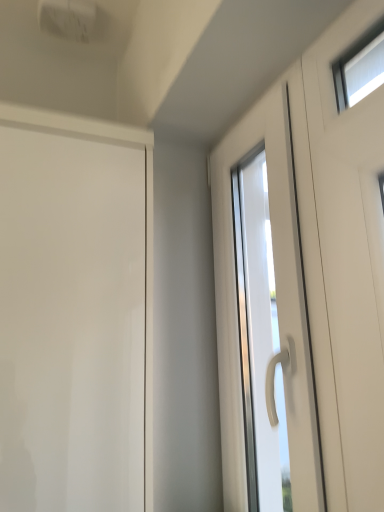
The image size is (384, 512). Describe the element at coordinates (277, 305) in the screenshot. I see `white glossy door at center, the 1th door viewed from the right` at that location.

Where is `white glossy door at center, the 1th door viewed from the right`? Image resolution: width=384 pixels, height=512 pixels. white glossy door at center, the 1th door viewed from the right is located at coordinates (x=277, y=305).

Describe the element at coordinates (71, 323) in the screenshot. I see `glossy white door at left, the 2th door from the right` at that location.

Find the location of a particular element. This screenshot has height=512, width=384. glossy white door at left, the 2th door from the right is located at coordinates (x=71, y=323).

The image size is (384, 512). Find the location of `white glossy door at center, which is the 2th door from left to right`. white glossy door at center, which is the 2th door from left to right is located at coordinates (277, 305).

Consider the image. Can you confirm if glossy white door at left, the 2th door from the right, is positioned to the left of white glossy door at center, which is the 2th door from left to right?

Correct, you'll find glossy white door at left, the 2th door from the right, to the left of white glossy door at center, which is the 2th door from left to right.

Which is in front, glossy white door at left, which ranks as the first door in left-to-right order, or white glossy door at center, the 1th door viewed from the right?

glossy white door at left, which ranks as the first door in left-to-right order, is more forward.

Is point (92, 303) closer or farther from the camera than point (218, 192)?

Point (92, 303).

From the image's perspective, is glossy white door at left, which ranks as the first door in left-to-right order, positioned above or below white glossy door at center, the 1th door viewed from the right?

glossy white door at left, which ranks as the first door in left-to-right order, is situated lower than white glossy door at center, the 1th door viewed from the right, in the image.

From a real-world perspective, is glossy white door at left, the 2th door from the right, physically above white glossy door at center, the 1th door viewed from the right?

Incorrect, from a real-world perspective, glossy white door at left, the 2th door from the right, is lower than white glossy door at center, the 1th door viewed from the right.

Considering the relative sizes of glossy white door at left, which ranks as the first door in left-to-right order, and white glossy door at center, which is the 2th door from left to right, in the image provided, is glossy white door at left, which ranks as the first door in left-to-right order, thinner than white glossy door at center, which is the 2th door from left to right,?

No, glossy white door at left, which ranks as the first door in left-to-right order, is not thinner than white glossy door at center, which is the 2th door from left to right.

Does glossy white door at left, the 2th door from the right, have a lesser height compared to white glossy door at center, the 1th door viewed from the right?

Yes, glossy white door at left, the 2th door from the right, is shorter than white glossy door at center, the 1th door viewed from the right.

Who is bigger, glossy white door at left, the 2th door from the right, or white glossy door at center, the 1th door viewed from the right?

glossy white door at left, the 2th door from the right, is bigger.

Is white glossy door at center, which is the 2th door from left to right, inside glossy white door at left, the 2th door from the right?

No, white glossy door at center, which is the 2th door from left to right, is not inside glossy white door at left, the 2th door from the right.

Is glossy white door at left, which ranks as the first door in left-to-right order, not near white glossy door at center, the 1th door viewed from the right?

Actually, glossy white door at left, which ranks as the first door in left-to-right order, and white glossy door at center, the 1th door viewed from the right, are a little close together.

Does glossy white door at left, the 2th door from the right, turn towards white glossy door at center, which is the 2th door from left to right?

No, glossy white door at left, the 2th door from the right, is not turned towards white glossy door at center, which is the 2th door from left to right.

Locate an element on the screen. Image resolution: width=384 pixels, height=512 pixels. door above the glossy white door at left, the 2th door from the right (from the image's perspective) is located at coordinates (277, 305).

Which object is positioned more to the right, white glossy door at center, the 1th door viewed from the right, or glossy white door at left, which ranks as the first door in left-to-right order?

Positioned to the right is white glossy door at center, the 1th door viewed from the right.

Which is in front, white glossy door at center, the 1th door viewed from the right, or glossy white door at left, the 2th door from the right?

glossy white door at left, the 2th door from the right, is in front.

Which is nearer, (320, 490) or (103, 385)?

Point (320, 490) appears to be closer to the viewer than point (103, 385).

From the image's perspective, would you say white glossy door at center, which is the 2th door from left to right, is shown under glossy white door at left, the 2th door from the right?

No, from the image's perspective, white glossy door at center, which is the 2th door from left to right, is not below glossy white door at left, the 2th door from the right.

From a real-world perspective, is white glossy door at center, the 1th door viewed from the right, physically located above or below glossy white door at left, which ranks as the first door in left-to-right order?

white glossy door at center, the 1th door viewed from the right, is above glossy white door at left, which ranks as the first door in left-to-right order.

Can you confirm if white glossy door at center, which is the 2th door from left to right, is wider than glossy white door at left, the 2th door from the right?

No.

Which of these two, white glossy door at center, the 1th door viewed from the right, or glossy white door at left, the 2th door from the right, stands shorter?

glossy white door at left, the 2th door from the right.

Who is bigger, white glossy door at center, the 1th door viewed from the right, or glossy white door at left, the 2th door from the right?

glossy white door at left, the 2th door from the right, is bigger.

Looking at this image, would you say white glossy door at center, which is the 2th door from left to right, is inside or outside glossy white door at left, which ranks as the first door in left-to-right order?

white glossy door at center, which is the 2th door from left to right, is outside glossy white door at left, which ranks as the first door in left-to-right order.

Is white glossy door at center, the 1th door viewed from the right, positioned far away from glossy white door at left, the 2th door from the right?

No, white glossy door at center, the 1th door viewed from the right, is not far from glossy white door at left, the 2th door from the right.

Consider the image. Is white glossy door at center, which is the 2th door from left to right, looking in the opposite direction of glossy white door at left, which ranks as the first door in left-to-right order?

No.

How different are the orientations of white glossy door at center, the 1th door viewed from the right, and glossy white door at left, which ranks as the first door in left-to-right order, in degrees?

The facing directions of white glossy door at center, the 1th door viewed from the right, and glossy white door at left, which ranks as the first door in left-to-right order, are 91.4 degrees apart.

This screenshot has width=384, height=512. What are the coordinates of `door in front of the white glossy door at center, the 1th door viewed from the right` in the screenshot? It's located at (71, 323).

The height and width of the screenshot is (512, 384). In order to click on door in front of the white glossy door at center, which is the 2th door from left to right in this screenshot , I will do `click(71, 323)`.

Image resolution: width=384 pixels, height=512 pixels. Identify the location of door above the glossy white door at left, which ranks as the first door in left-to-right order (from a real-world perspective). (277, 305).